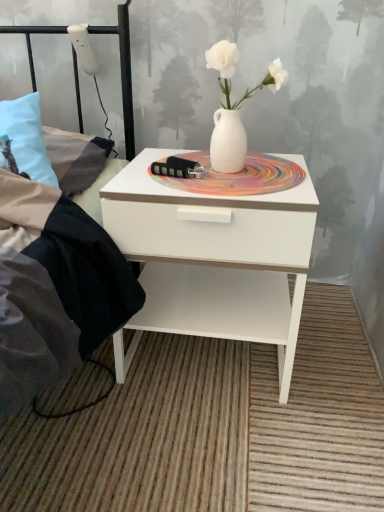
I want to click on vacant region under white glossy nightstand at center (from a real-world perspective), so click(x=208, y=361).